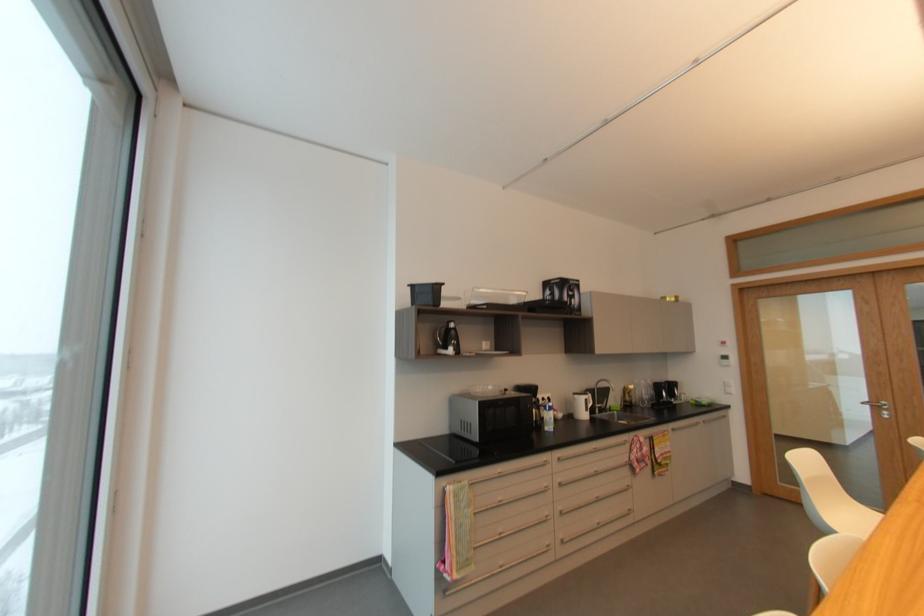
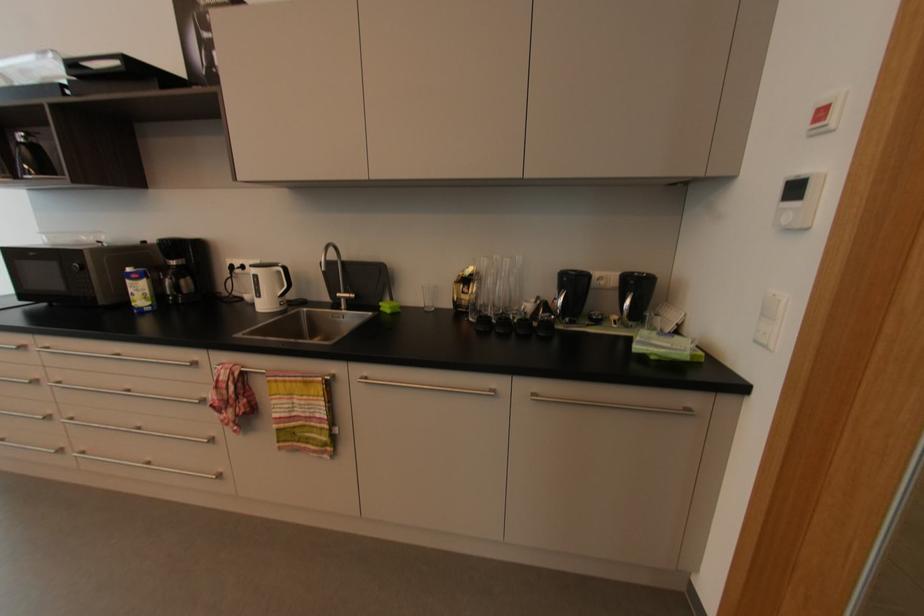
In the second image, find the point that corresponds to point 734,394 in the first image.

(769, 347)